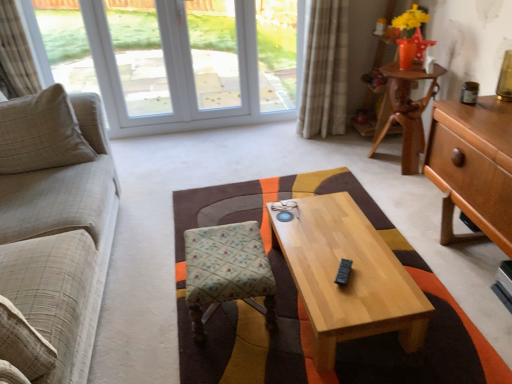
Find the location of `vacant space in front of patterned fabric stool at center`. vacant space in front of patterned fabric stool at center is located at coordinates (223, 357).